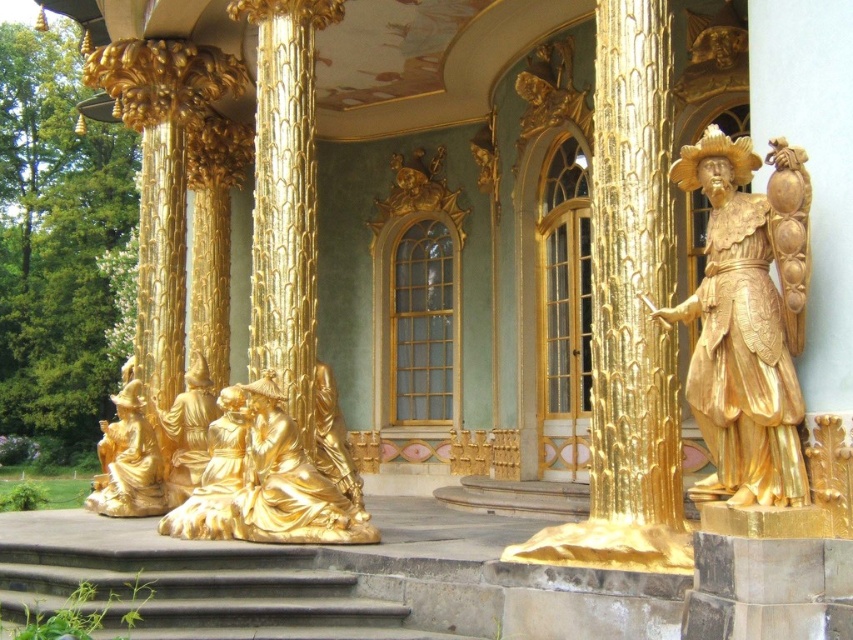
You are an interior designer planning to place a new piece of furniture in the room. You have two statues available. The gold polished wood statue at right and the gold textured statue at lower left. Which statue has a greater width?

The gold polished wood statue at right has a greater width than the gold textured statue at lower left.